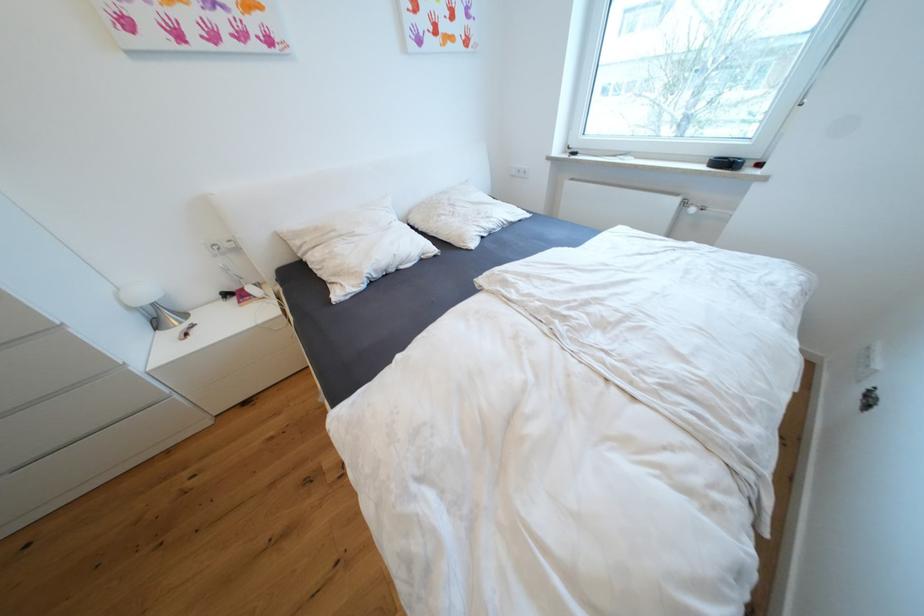
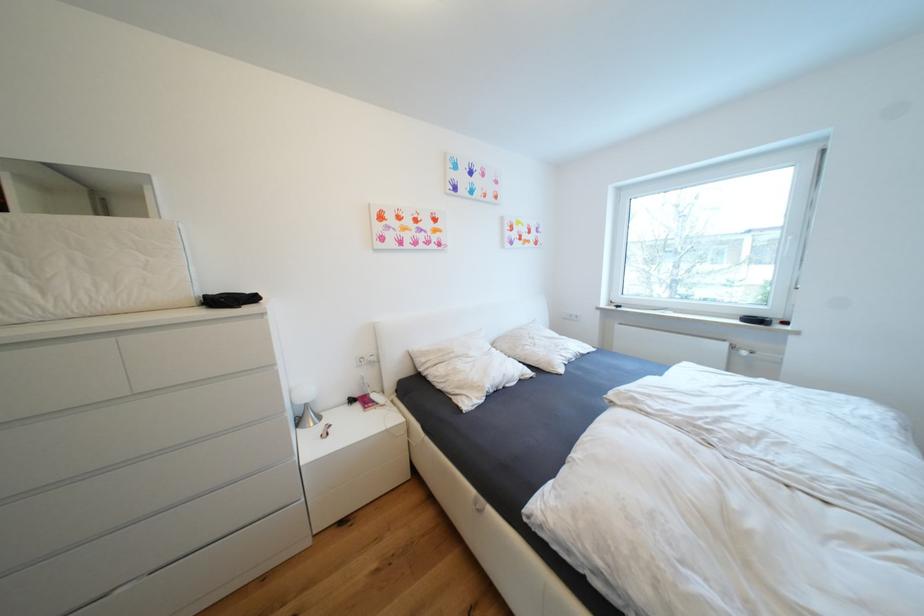
The point at (684, 201) is marked in the first image. Where is the corresponding point in the second image?

(733, 346)